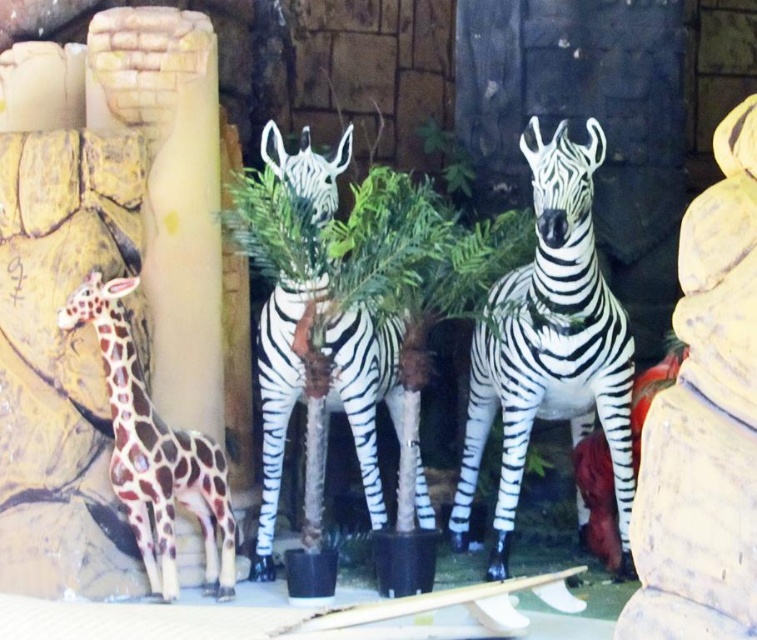
Locate an element on the screen. white glossy zebra at center is located at coordinates (550, 346).

Is white glossy zebra at center smaller than shiny brown giraffe at left?

Incorrect, white glossy zebra at center is not smaller in size than shiny brown giraffe at left.

This screenshot has height=640, width=757. What are the coordinates of `white glossy zebra at center` in the screenshot? It's located at (550, 346).

Find the location of `white glossy zebra at center`. white glossy zebra at center is located at coordinates (550, 346).